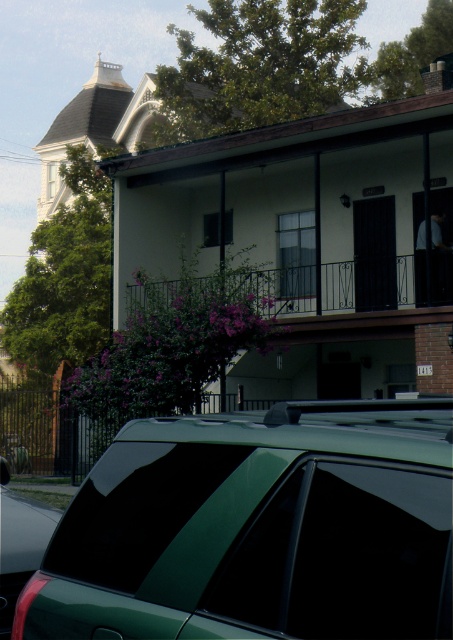
You are standing in front of the house and want to determine the relative positions of two points marked on the image. Which point is closer to you, point at coordinates (273, 278) or point at coordinates (25, 564)?

Point at coordinates (273, 278) is further to the viewer than point at coordinates (25, 564), so the point at coordinates (25, 564) is closer to you.

You are standing in front of the house and need to know if the iron black balcony at center can accommodate a large potted plant that requires more space than the metallic green car at lower left. Based on their widths, can the balcony support the plant?

The iron black balcony at center is wider than the metallic green car at lower left, so it can accommodate the large potted plant that requires more space than the car.